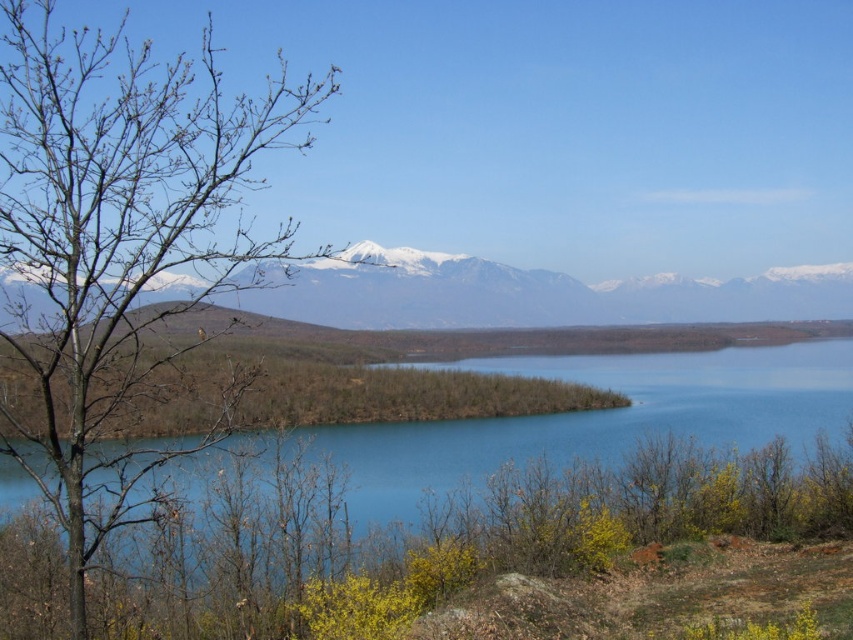
Question: Can you confirm if bare branches at left is wider than blue water at center?

Choices:
 (A) no
 (B) yes

Answer: (A)

Question: From the image, what is the correct spatial relationship of blue water at center in relation to snowy white mountain range at upper center?

Choices:
 (A) left
 (B) right

Answer: (A)

Question: Is blue water at center behind snowy white mountain range at upper center?

Choices:
 (A) no
 (B) yes

Answer: (B)

Question: Which of the following is the farthest from the observer?

Choices:
 (A) snowy white mountain range at upper center
 (B) blue water at center
 (C) bare branches at left

Answer: (B)

Question: Based on their relative distances, which object is farther from the blue water at center?

Choices:
 (A) bare branches at left
 (B) snowy white mountain range at upper center

Answer: (B)

Question: Which object is the closest to the blue water at center?

Choices:
 (A) snowy white mountain range at upper center
 (B) bare branches at left

Answer: (B)